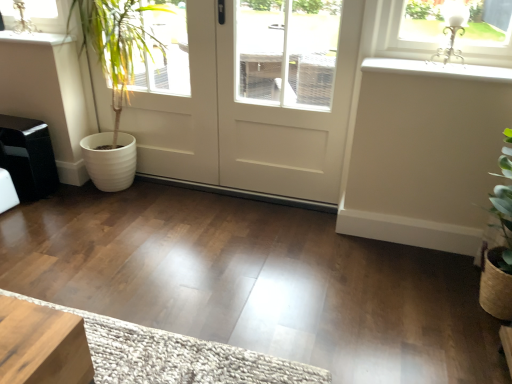
Find the location of `free space behind white textured doormat at lower center`. free space behind white textured doormat at lower center is located at coordinates (167, 252).